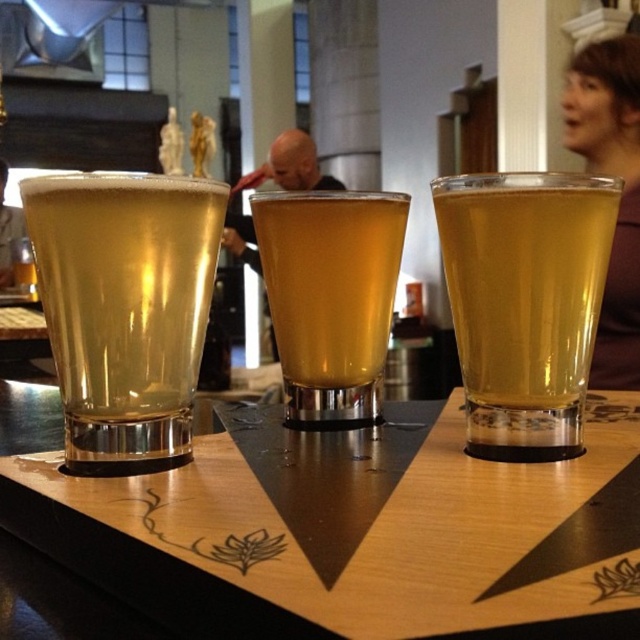
You are organizing a small event and need to decide where to place a large poster. The poster is the size of the brown fabric shirt at upper right. There is a wall space that can accommodate items up to the size of the matte black laptop at left. Will the poster fit on this wall space?

The brown fabric shirt at upper right is bigger than the matte black laptop at left, so the poster will not fit on the wall space since it is larger than the available space.

You are a bartender who needs to place a 5.5 inch wide coaster between the wooden tray at center and the translucent glass at left. Can you fit it there?

The distance between the wooden tray at center and the translucent glass at left is 5.15 inches. Since the coaster is 5.5 inches wide, it would not fit in the space between them.